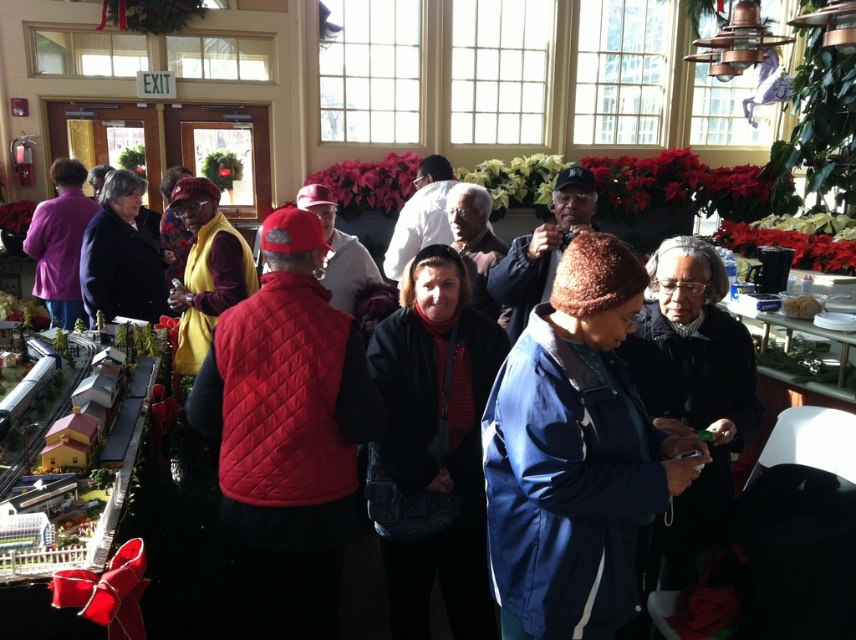
Question: Is matte purple jacket at left behind white fluffy bread at center?

Choices:
 (A) no
 (B) yes

Answer: (B)

Question: Can you confirm if matte purple jacket at left is positioned to the left of white fluffy bread at center?

Choices:
 (A) no
 (B) yes

Answer: (B)

Question: Which point is closer to the camera taking this photo?

Choices:
 (A) (x=798, y=312)
 (B) (x=48, y=225)

Answer: (A)

Question: Is matte purple jacket at left positioned in front of white fluffy bread at center?

Choices:
 (A) yes
 (B) no

Answer: (B)

Question: Which of the following is the farthest from the observer?

Choices:
 (A) (75, 160)
 (B) (806, 314)

Answer: (A)

Question: Which point is farther to the camera?

Choices:
 (A) (69, 291)
 (B) (819, 305)

Answer: (A)